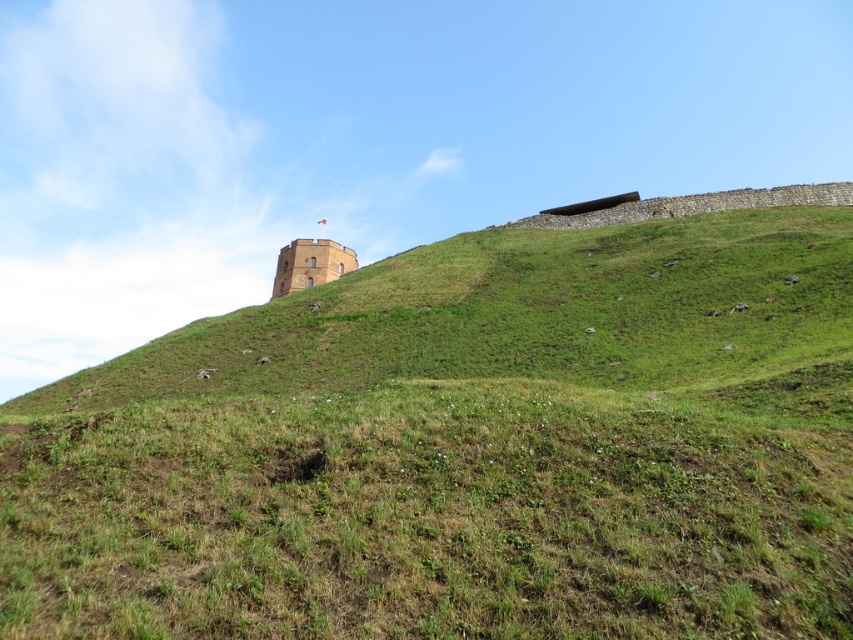
Does point (607, 333) come in front of point (276, 262)?

Yes, it is.

Who is more distant from viewer, (505, 404) or (279, 282)?

Positioned behind is point (279, 282).

This screenshot has height=640, width=853. In order to click on green grassy hill at upper center in this screenshot , I will do `click(463, 449)`.